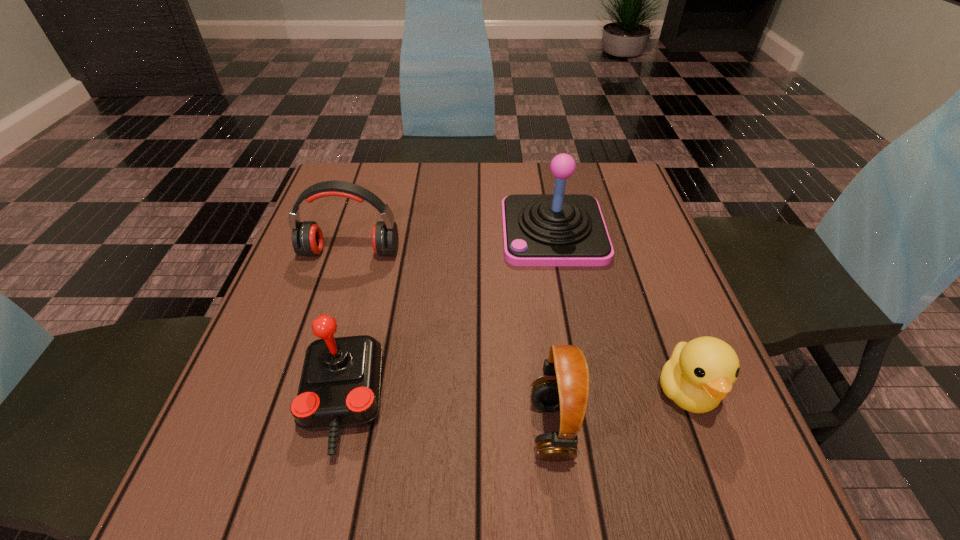
You are a GUI agent. You are given a task and a screenshot of the screen. Output one action in this format:
    pyautogui.click(x=<x>, y=<y>)
    Task: Click on the vacant space at the far right corner of the desktop
    This screenshot has width=960, height=540.
    Given the screenshot: What is the action you would take?
    pyautogui.click(x=626, y=198)

Where is `vacant space at the near right corner`? The height and width of the screenshot is (540, 960). vacant space at the near right corner is located at coordinates (660, 494).

The image size is (960, 540). What are the coordinates of `empty space between the headset and the farther joystick` in the screenshot? It's located at (552, 330).

Where is `empty space that is in between the nearer joystick and the taller joystick`? This screenshot has width=960, height=540. empty space that is in between the nearer joystick and the taller joystick is located at coordinates (448, 317).

Where is `free space between the duck and the farther joystick`? The height and width of the screenshot is (540, 960). free space between the duck and the farther joystick is located at coordinates (620, 312).

Find the location of a particular element. The width and height of the screenshot is (960, 540). free area in between the headset and the nearer joystick is located at coordinates (446, 415).

At what (x,y) coordinates should I click in order to perform the action: click on empty space between the headset and the rightmost object. Please return your answer as a coordinate pair (x, y). This screenshot has width=960, height=540. Looking at the image, I should click on (618, 410).

You are a GUI agent. You are given a task and a screenshot of the screen. Output one action in this format:
    pyautogui.click(x=<x>, y=<y>)
    Task: Click on the free spot between the duck and the nearer joystick
    The image size is (960, 540).
    Given the screenshot: What is the action you would take?
    pyautogui.click(x=515, y=396)

Where is `free space between the headset and the left joystick`? The height and width of the screenshot is (540, 960). free space between the headset and the left joystick is located at coordinates coord(446,415).

Locate an element on the screen. This screenshot has height=540, width=960. free space between the duck and the right joystick is located at coordinates (620, 312).